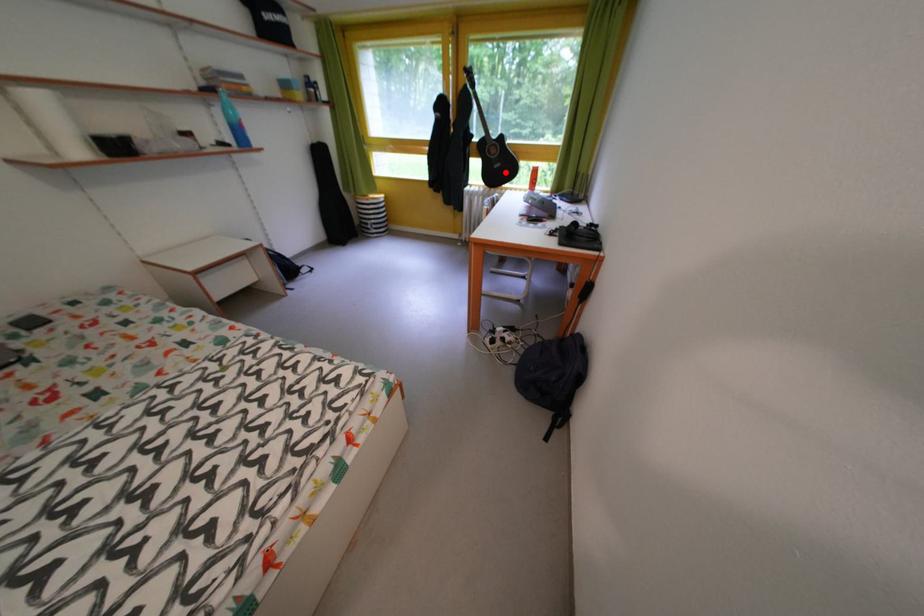
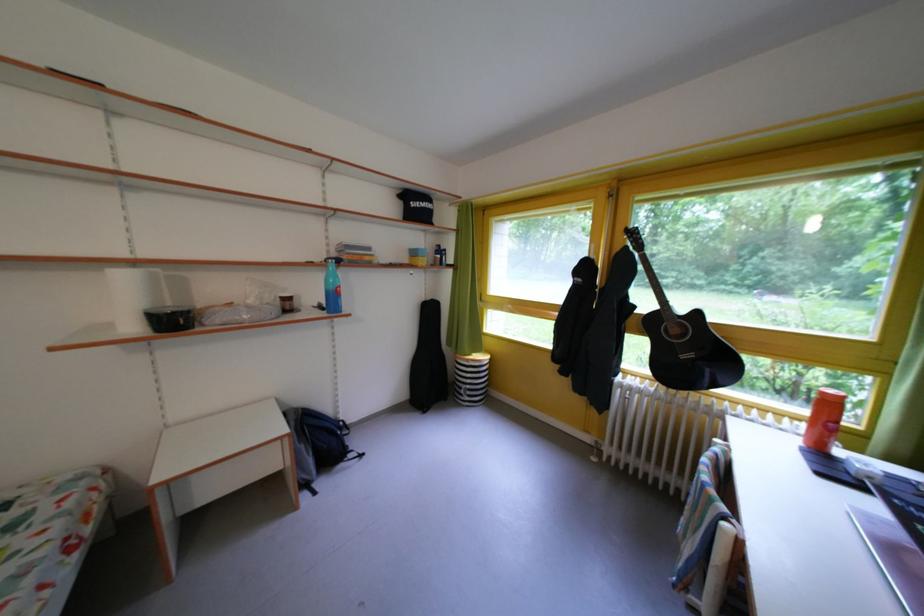
Where in the second image is the point corresponding to the highlighted location from the first image?

(693, 362)